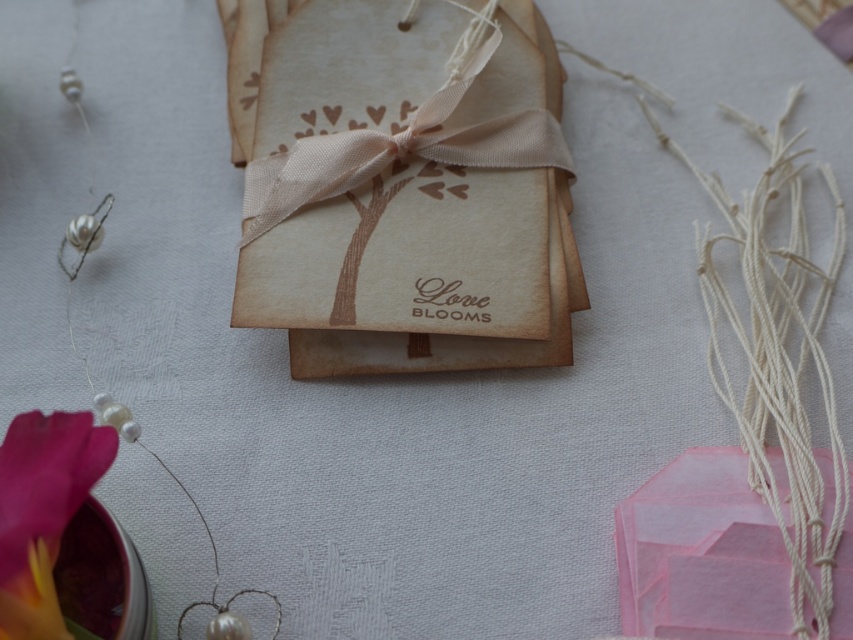
How much distance is there between matte brown paper bag at center and white string at upper right?

matte brown paper bag at center is 14.01 inches from white string at upper right.

Does matte brown paper bag at center appear under white string at upper right?

No, matte brown paper bag at center is not below white string at upper right.

Who is more forward, (524, 193) or (833, 486)?

Point (833, 486)

Image resolution: width=853 pixels, height=640 pixels. I want to click on matte brown paper bag at center, so click(402, 188).

Is point (844, 458) positioned after point (33, 435)?

That is True.

Is white string at upper right positioned in front of matte pink petal at lower left?

No, white string at upper right is further to the viewer.

Identify the location of white string at upper right. This screenshot has width=853, height=640. (776, 358).

Does matte brown paper bag at center appear on the left side of matte pink petal at lower left?

No, matte brown paper bag at center is not to the left of matte pink petal at lower left.

How far apart are matte brown paper bag at center and matte pink petal at lower left?

matte brown paper bag at center is 22.05 inches away from matte pink petal at lower left.

Is point (262, 211) farther from camera compared to point (16, 524)?

Yes, point (262, 211) is farther from viewer.

At what (x,y) coordinates should I click in order to perform the action: click on matte brown paper bag at center. Please return your answer as a coordinate pair (x, y). Image resolution: width=853 pixels, height=640 pixels. Looking at the image, I should click on (402, 188).